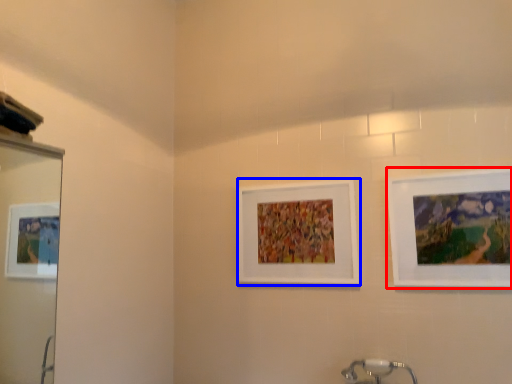
Question: Which of the following is the farthest to the observer, picture frame (highlighted by a red box) or picture frame (highlighted by a blue box)?

Choices:
 (A) picture frame
 (B) picture frame

Answer: (B)